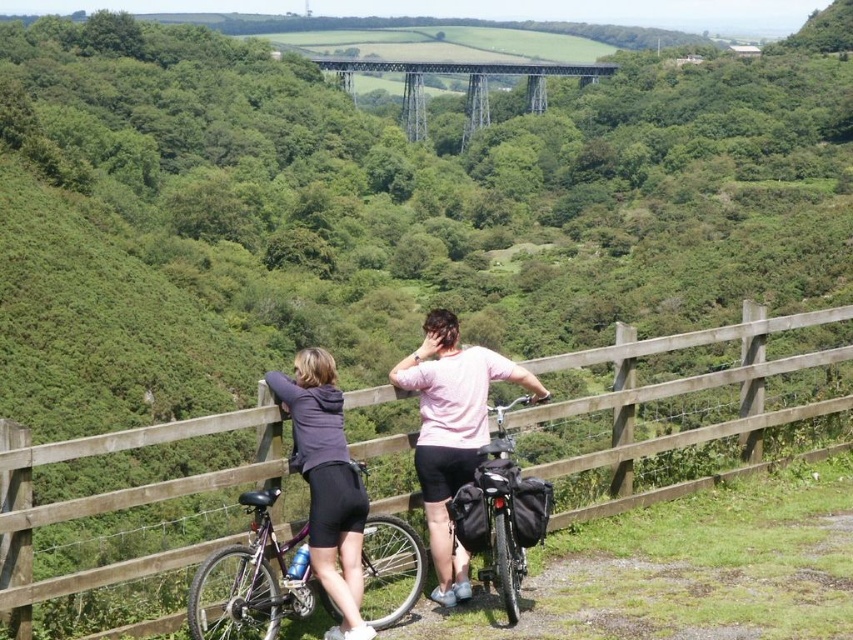
You are standing at the point with coordinates 0.5, 0.5 in the image. You want to walk towards the wooden fence at center. Which direction should you move?

You should move towards the upper right direction since the wooden fence at center is located at point (679, 385), which is northeast of your current position at (426, 320).

You are standing at point (679, 385) in the image. What object are you directly facing?

The wooden fence at center is located at point (679, 385), so you are directly facing the wooden fence at center.

You are a photographer trying to capture a photo of the matte purple hoodie at center without the wooden fence at center blocking the view. Based on the scene, is this possible?

The wooden fence at center is much taller than the matte purple hoodie at center, so the fence would block the view of the hoodie unless you crouch down or move to a lower angle to avoid the obstruction.